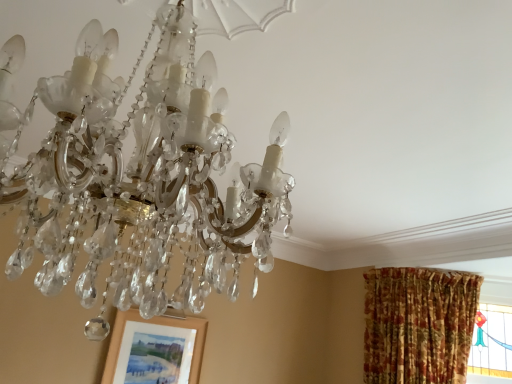
Question: In the image, is matte wooden picture frame at lower left positioned in front of or behind clear crystal chandelier at upper center?

Choices:
 (A) front
 (B) behind

Answer: (B)

Question: From a real-world perspective, is matte wooden picture frame at lower left above or below clear crystal chandelier at upper center?

Choices:
 (A) above
 (B) below

Answer: (B)

Question: In terms of width, does matte wooden picture frame at lower left look wider or thinner when compared to clear crystal chandelier at upper center?

Choices:
 (A) wide
 (B) thin

Answer: (B)

Question: Considering the positions of point (119, 221) and point (176, 382), is point (119, 221) closer or farther from the camera than point (176, 382)?

Choices:
 (A) farther
 (B) closer

Answer: (B)

Question: Looking at their shapes, would you say clear crystal chandelier at upper center is wider or thinner than matte wooden picture frame at lower left?

Choices:
 (A) thin
 (B) wide

Answer: (B)

Question: Is clear crystal chandelier at upper center spatially inside matte wooden picture frame at lower left, or outside of it?

Choices:
 (A) inside
 (B) outside

Answer: (B)

Question: In the image, is clear crystal chandelier at upper center on the left side or the right side of matte wooden picture frame at lower left?

Choices:
 (A) left
 (B) right

Answer: (B)